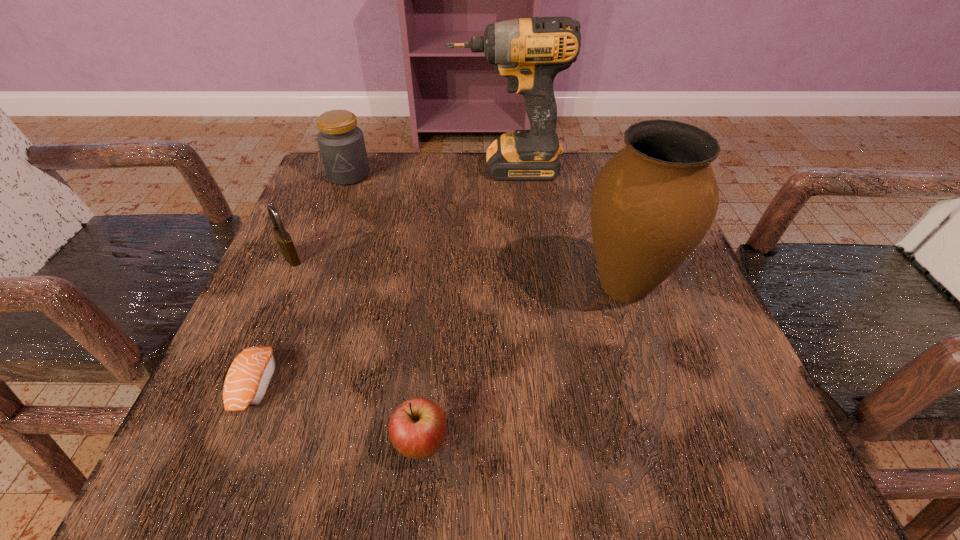
You are a GUI agent. You are given a task and a screenshot of the screen. Output one action in this format:
    pyautogui.click(x=<x>, y=<y>)
    Task: Click on the vacant region located 0.090m with the drill bit of the drill facing forward
    The width and height of the screenshot is (960, 540).
    Given the screenshot: What is the action you would take?
    pyautogui.click(x=413, y=168)

Where is `free space located 0.240m on the front of the second tallest object`? This screenshot has width=960, height=540. free space located 0.240m on the front of the second tallest object is located at coordinates (687, 482).

Locate an element on the screen. free space located on the surface of the fourth shortest object near the warning symbol is located at coordinates (322, 246).

You are a GUI agent. You are given a task and a screenshot of the screen. Output one action in this format:
    pyautogui.click(x=<x>, y=<y>)
    Task: Click on the vacant space situated on the back of the padlock
    The image size is (960, 540).
    Given the screenshot: What is the action you would take?
    pyautogui.click(x=319, y=197)

Where is `vacant position located on the right of the apple`? The height and width of the screenshot is (540, 960). vacant position located on the right of the apple is located at coordinates (620, 444).

At what (x,y) coordinates should I click in order to perform the action: click on blank space located 0.190m on the right of the sushi. Please return your answer as a coordinate pair (x, y). This screenshot has height=540, width=960. Looking at the image, I should click on (405, 383).

Identify the location of drill situated at the far edge. (529, 52).

Identify the location of jar at the far edge. (341, 143).

This screenshot has width=960, height=540. I want to click on apple that is at the near edge, so click(x=417, y=428).

Find the location of `sushi positioned at the near edge`. sushi positioned at the near edge is located at coordinates (248, 378).